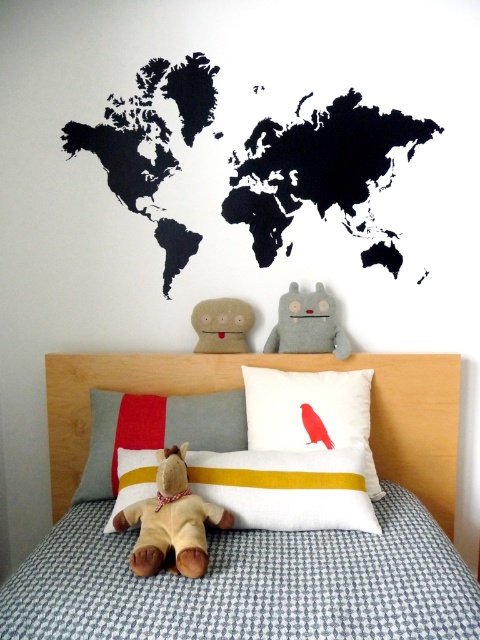
Question: Does beige plush teddy bear at center come behind beige fabric plush at center?

Choices:
 (A) yes
 (B) no

Answer: (B)

Question: Which of these objects is positioned farthest from the matte yellow stuffed animal at center?

Choices:
 (A) gray fabric pillow with yellow stripe at center
 (B) white/yellow striped pillow at center
 (C) gray felt plush at center

Answer: (A)

Question: Which object is positioned farthest from the black felt map at upper center?

Choices:
 (A) beige plush teddy bear at center
 (B) gray fabric pillow with yellow stripe at center

Answer: (A)

Question: Which of the following is the farthest from the observer?

Choices:
 (A) white fabric pillow with red bird at center
 (B) beige fabric plush at center

Answer: (B)

Question: From the image, what is the correct spatial relationship of white/yellow striped pillow at center in relation to beige fabric plush at center?

Choices:
 (A) above
 (B) below

Answer: (B)

Question: Where is white fabric pillow with red bird at center located in relation to gray felt plush at center in the image?

Choices:
 (A) right
 (B) left

Answer: (B)